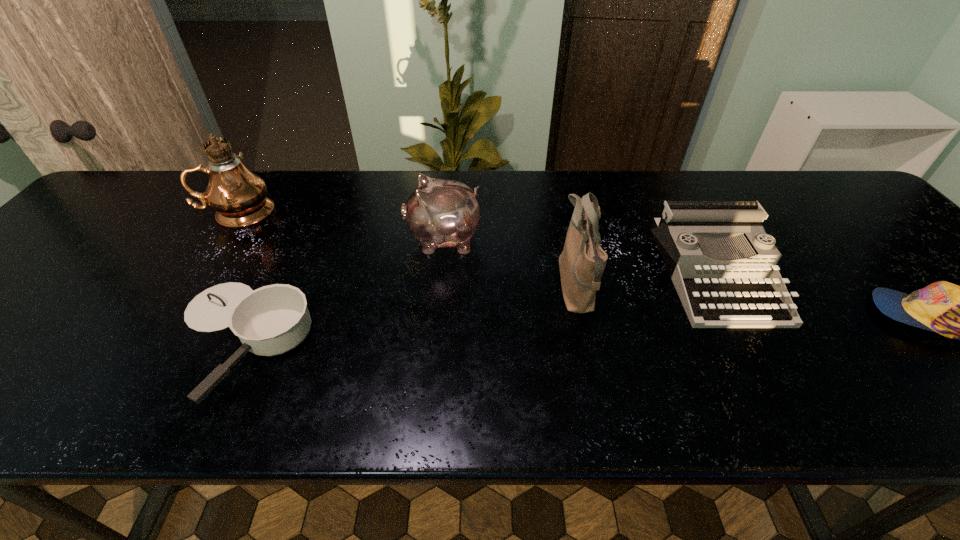
Image resolution: width=960 pixels, height=540 pixels. In the image, there is a desktop. Find the location of `free region at the near edge`. free region at the near edge is located at coordinates pyautogui.click(x=190, y=401).

Where is `vacant space at the right edge of the desktop`? Image resolution: width=960 pixels, height=540 pixels. vacant space at the right edge of the desktop is located at coordinates (878, 259).

Locate an element on the screen. Image resolution: width=960 pixels, height=540 pixels. free space at the far right corner of the desktop is located at coordinates (810, 199).

In order to click on free space between the tallest object and the shortest object in this screenshot , I will do `click(239, 276)`.

The height and width of the screenshot is (540, 960). Find the location of `vacant space in between the fourth shortest object and the tallest object`. vacant space in between the fourth shortest object and the tallest object is located at coordinates (341, 226).

What are the coordinates of `free spot between the third tallest object and the fourth object from left to right` in the screenshot? It's located at (510, 264).

Locate an element on the screen. This screenshot has height=540, width=960. empty space between the shoulder bag and the tallest object is located at coordinates (408, 250).

Locate an element on the screen. vacant point located between the shortest object and the third object from right to left is located at coordinates (408, 313).

Where is `blank region between the shoulder bag and the shortest object`? Image resolution: width=960 pixels, height=540 pixels. blank region between the shoulder bag and the shortest object is located at coordinates (408, 313).

I want to click on the fifth closest object relative to the piggy bank, so click(959, 312).